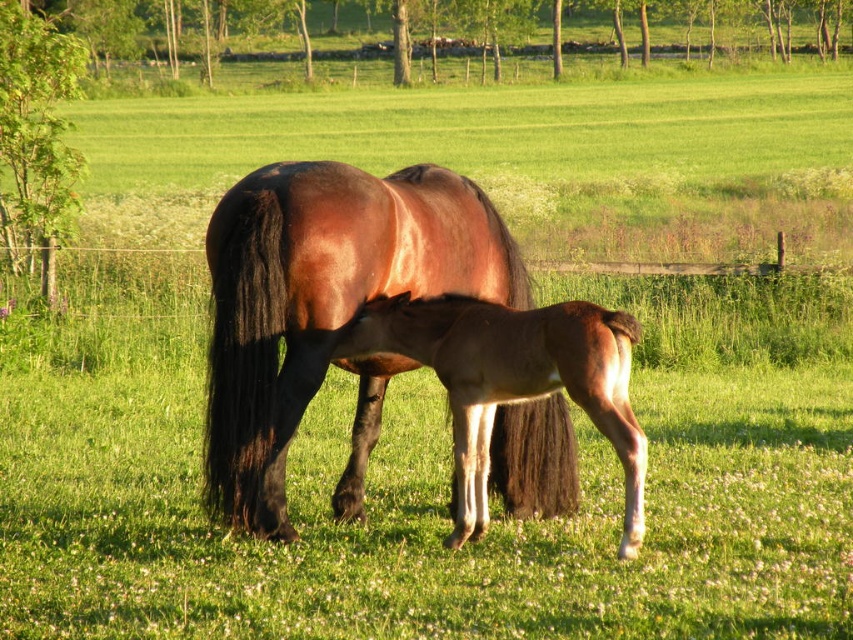
Does shiny brown horse at center appear over brown glossy foal at center?

Yes, shiny brown horse at center is above brown glossy foal at center.

Where is `shiny brown horse at center`? This screenshot has width=853, height=640. shiny brown horse at center is located at coordinates (322, 300).